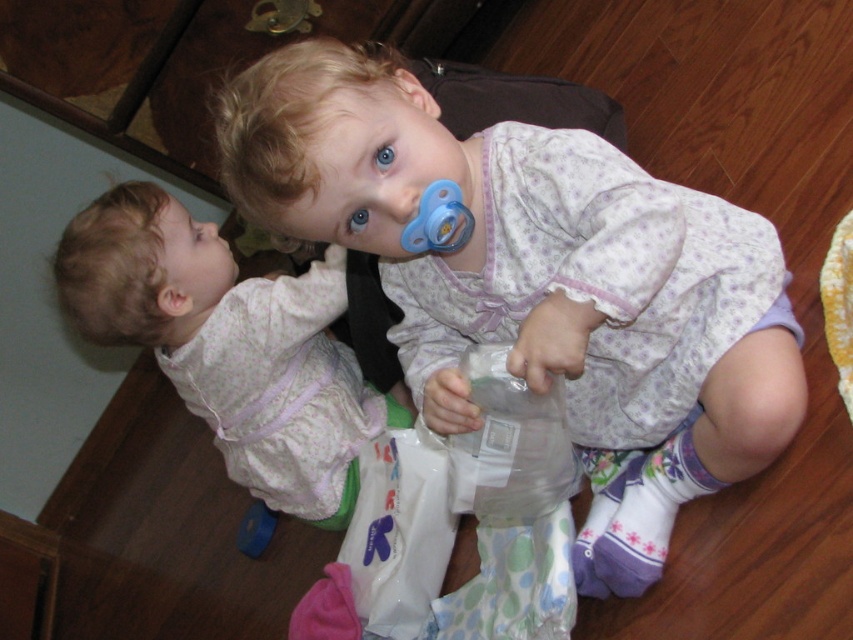
Can you confirm if pink fabric diaper at lower left is positioned below blue rubber toy at lower left?

No.

This screenshot has width=853, height=640. What do you see at coordinates (229, 346) in the screenshot?
I see `pink fabric diaper at lower left` at bounding box center [229, 346].

I want to click on pink fabric diaper at lower left, so click(229, 346).

Who is positioned more to the left, blue rubber pacifier at upper center or blue rubber toy at lower left?

blue rubber toy at lower left is more to the left.

Is blue rubber pacifier at upper center in front of blue rubber toy at lower left?

That is True.

Between point (450, 198) and point (247, 518), which one is positioned behind?

The point (247, 518) is more distant.

Locate an element on the screen. The image size is (853, 640). blue rubber pacifier at upper center is located at coordinates (438, 220).

Is pink fabric diaper at lower left wider than transparent plastic bottle at center?

Indeed, pink fabric diaper at lower left has a greater width compared to transparent plastic bottle at center.

Find the location of a particular element. The width and height of the screenshot is (853, 640). pink fabric diaper at lower left is located at coordinates (229, 346).

Between point (140, 269) and point (474, 477), which one is positioned behind?

The point (140, 269) is behind.

At what (x,y) coordinates should I click in order to perform the action: click on pink fabric diaper at lower left. Please return your answer as a coordinate pair (x, y). The width and height of the screenshot is (853, 640). Looking at the image, I should click on (229, 346).